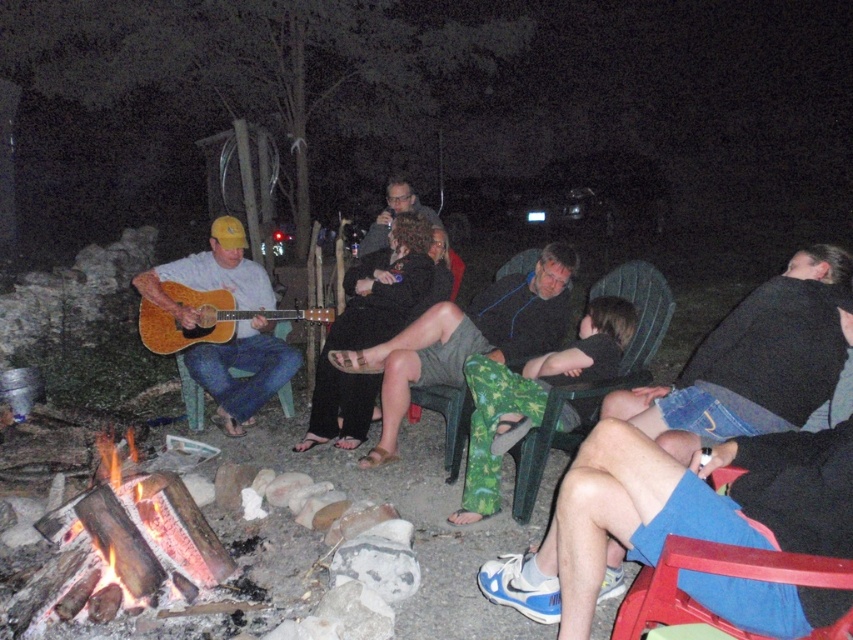
Question: Is acoustic wood guitar at left below matte black shirt at center?

Choices:
 (A) no
 (B) yes

Answer: (B)

Question: Which point is farther from the camera taking this photo?

Choices:
 (A) (166, 321)
 (B) (126, 596)
 (C) (497, 355)

Answer: (A)

Question: Is black fuzzy vest at upper right below charcoal wood fire at lower left?

Choices:
 (A) yes
 (B) no

Answer: (B)

Question: Which of these objects is positioned closest to the wooden acoustic guitar at left?

Choices:
 (A) matte black shirt at center
 (B) charcoal wood fire at lower left
 (C) green textured shorts at center

Answer: (C)

Question: Is wooden acoustic guitar at left to the right of acoustic wood guitar at left from the viewer's perspective?

Choices:
 (A) yes
 (B) no

Answer: (B)

Question: Which of the following is the farthest from the observer?

Choices:
 (A) acoustic wood guitar at left
 (B) matte black shirt at center
 (C) black fuzzy vest at upper right

Answer: (B)